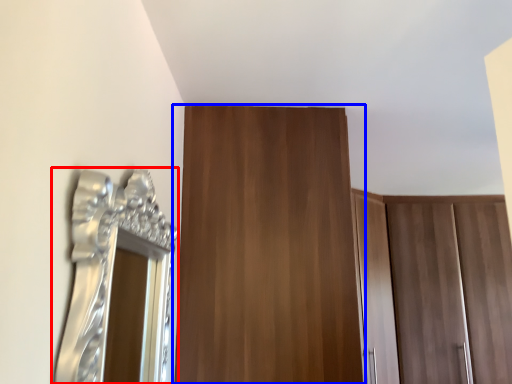
Question: Which object appears farthest to the camera in this image, mirror (highlighted by a red box) or door (highlighted by a blue box)?

Choices:
 (A) mirror
 (B) door

Answer: (B)